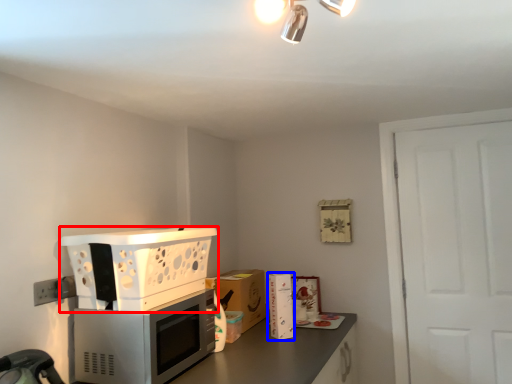
Question: Which point is closer to the camera, kitchen appliance (highlighted by a red box) or appliance (highlighted by a blue box)?

Choices:
 (A) kitchen appliance
 (B) appliance

Answer: (A)